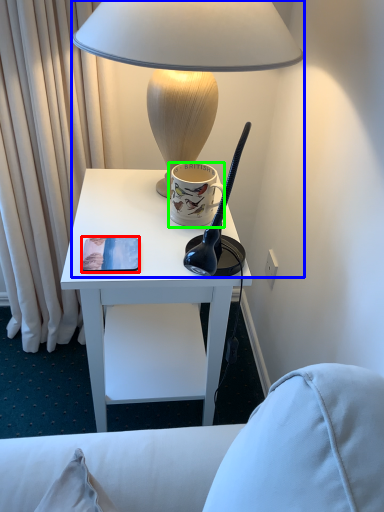
Question: Which object is the farthest from pad (highlighted by a red box)? Choose among these: lamp (highlighted by a blue box) or coffee cup (highlighted by a green box).

Choices:
 (A) lamp
 (B) coffee cup

Answer: (A)